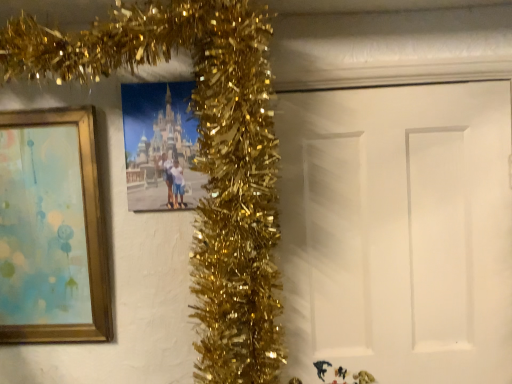
Question: Considering the relative sizes of white matte door at center and matte plastic photo frame at center, positioned as the second picture frame in left-to-right order, in the image provided, is white matte door at center wider than matte plastic photo frame at center, positioned as the second picture frame in left-to-right order,?

Choices:
 (A) yes
 (B) no

Answer: (B)

Question: Can you confirm if white matte door at center is thinner than matte plastic photo frame at center, positioned as the second picture frame in left-to-right order?

Choices:
 (A) yes
 (B) no

Answer: (A)

Question: Does white matte door at center have a lesser height compared to matte plastic photo frame at center, which is the 1th picture frame from right to left?

Choices:
 (A) yes
 (B) no

Answer: (B)

Question: Does white matte door at center have a smaller size compared to matte plastic photo frame at center, which is the 1th picture frame from right to left?

Choices:
 (A) no
 (B) yes

Answer: (A)

Question: Can you confirm if white matte door at center is positioned to the right of matte plastic photo frame at center, positioned as the second picture frame in left-to-right order?

Choices:
 (A) yes
 (B) no

Answer: (A)

Question: Is the position of white matte door at center more distant than that of matte plastic photo frame at center, positioned as the second picture frame in left-to-right order?

Choices:
 (A) yes
 (B) no

Answer: (A)

Question: Is matte plastic photo frame at center, which is the 1th picture frame from right to left, far away from gold wood picture frame at left, the second picture frame from the right?

Choices:
 (A) no
 (B) yes

Answer: (A)

Question: Is matte plastic photo frame at center, which is the 1th picture frame from right to left, to the right of gold wood picture frame at left, which is the 1th picture frame from left to right, from the viewer's perspective?

Choices:
 (A) yes
 (B) no

Answer: (A)

Question: Is matte plastic photo frame at center, which is the 1th picture frame from right to left, at the left side of gold wood picture frame at left, the second picture frame from the right?

Choices:
 (A) yes
 (B) no

Answer: (B)

Question: Is matte plastic photo frame at center, positioned as the second picture frame in left-to-right order, shorter than gold wood picture frame at left, the second picture frame from the right?

Choices:
 (A) no
 (B) yes

Answer: (B)

Question: Is matte plastic photo frame at center, which is the 1th picture frame from right to left, facing away from gold wood picture frame at left, which is the 1th picture frame from left to right?

Choices:
 (A) yes
 (B) no

Answer: (B)

Question: Does matte plastic photo frame at center, positioned as the second picture frame in left-to-right order, have a smaller size compared to gold wood picture frame at left, the second picture frame from the right?

Choices:
 (A) yes
 (B) no

Answer: (A)

Question: Can you confirm if gold wood picture frame at left, the second picture frame from the right, is wider than matte plastic photo frame at center, positioned as the second picture frame in left-to-right order?

Choices:
 (A) no
 (B) yes

Answer: (B)